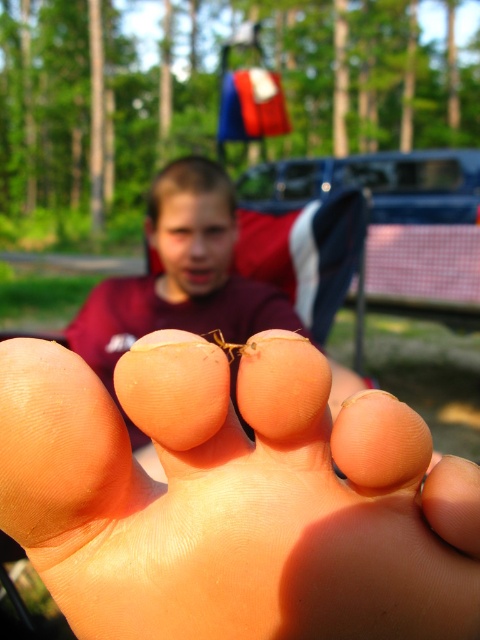
Question: Which point appears closest to the camera in this image?

Choices:
 (A) (223, 310)
 (B) (255, 342)

Answer: (B)

Question: Which of the following is the farthest from the observer?

Choices:
 (A) (197, 166)
 (B) (210, 336)
 (C) (49, 404)

Answer: (A)

Question: Which point appears closest to the camera in this image?

Choices:
 (A) (222, 282)
 (B) (288, 628)
 (C) (218, 337)

Answer: (C)

Question: Does pink flesh-toned foot at center have a larger size compared to yellow translucent ant at center?

Choices:
 (A) yes
 (B) no

Answer: (A)

Question: Considering the relative positions of pink flesh-toned foot at center and matte skin boy at center in the image provided, where is pink flesh-toned foot at center located with respect to matte skin boy at center?

Choices:
 (A) below
 (B) above

Answer: (A)

Question: Is matte skin boy at center above yellow translucent ant at center?

Choices:
 (A) yes
 (B) no

Answer: (B)